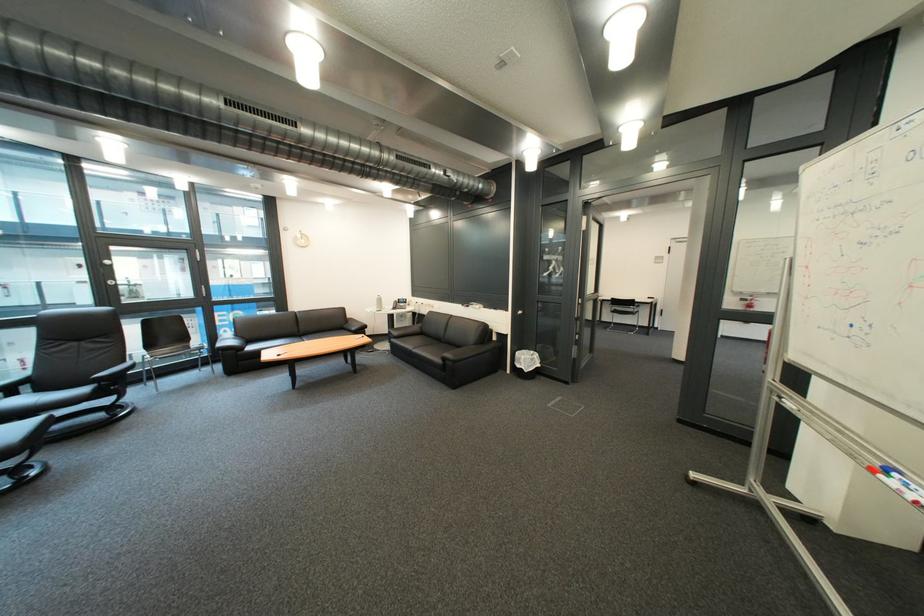
Find where to resting arm the chair armrest. Please return your answer as a coordinate pair (x, y).

(113, 371)